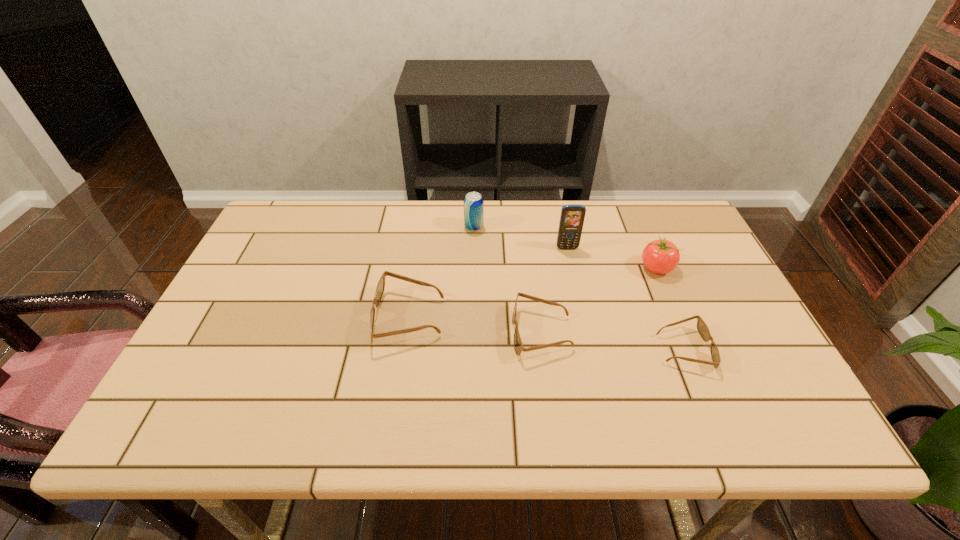
Image resolution: width=960 pixels, height=540 pixels. What are the coordinates of `vacant space located on the screen of the third object from right to left` in the screenshot? It's located at (583, 321).

Find the location of a particular element. free region located 0.260m on the back of the third farthest object is located at coordinates (630, 205).

Locate an element on the screen. This screenshot has height=540, width=960. beer can that is positioned at the far edge is located at coordinates (473, 202).

Find the location of a particular element. cellular telephone present at the far edge is located at coordinates (572, 216).

Identify the location of object at the near edge. (702, 328).

The width and height of the screenshot is (960, 540). Find the location of `sunglasses at the right edge`. sunglasses at the right edge is located at coordinates (702, 328).

Locate an element on the screen. tomato situated at the right edge is located at coordinates (660, 256).

Locate an element on the screen. object that is at the near right corner is located at coordinates (702, 328).

In the image, there is a desktop. Where is `vacant space at the far edge`? The image size is (960, 540). vacant space at the far edge is located at coordinates (544, 220).

Where is `free region at the near edge of the desktop`? free region at the near edge of the desktop is located at coordinates (432, 392).